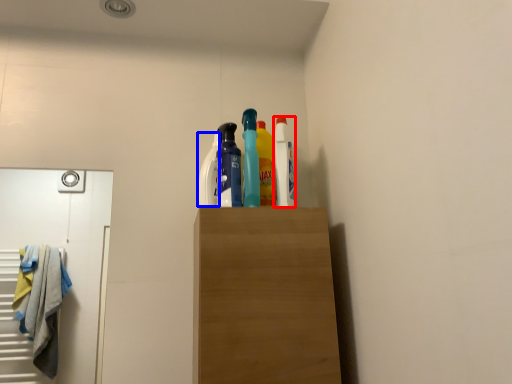
Question: Which of the following is the closest to the observer, cleaning product (highlighted by a red box) or cleaning product (highlighted by a blue box)?

Choices:
 (A) cleaning product
 (B) cleaning product

Answer: (A)